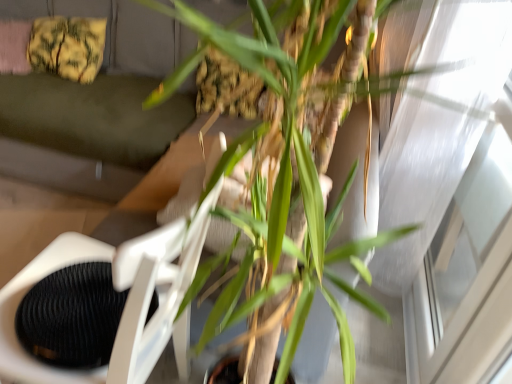
Question: From a real-world perspective, is transparent glass window at upper right on green leafy plant at center?

Choices:
 (A) yes
 (B) no

Answer: (B)

Question: From a real-world perspective, is transparent glass window at upper right below green leafy plant at center?

Choices:
 (A) yes
 (B) no

Answer: (A)

Question: Can you confirm if transparent glass window at upper right is smaller than green leafy plant at center?

Choices:
 (A) yes
 (B) no

Answer: (A)

Question: Considering the relative positions of transparent glass window at upper right and green leafy plant at center in the image provided, is transparent glass window at upper right behind green leafy plant at center?

Choices:
 (A) yes
 (B) no

Answer: (A)

Question: Is there a large distance between transparent glass window at upper right and green leafy plant at center?

Choices:
 (A) no
 (B) yes

Answer: (A)

Question: Does transparent glass window at upper right appear on the right side of green leafy plant at center?

Choices:
 (A) no
 (B) yes

Answer: (B)

Question: From a real-world perspective, is green fabric couch at upper center positioned under green leafy plant at center based on gravity?

Choices:
 (A) yes
 (B) no

Answer: (A)

Question: Is green fabric couch at upper center to the right of green leafy plant at center from the viewer's perspective?

Choices:
 (A) yes
 (B) no

Answer: (B)

Question: Can you confirm if green fabric couch at upper center is smaller than green leafy plant at center?

Choices:
 (A) yes
 (B) no

Answer: (B)

Question: From the image's perspective, is green fabric couch at upper center over green leafy plant at center?

Choices:
 (A) no
 (B) yes

Answer: (B)

Question: Does green fabric couch at upper center have a greater width compared to green leafy plant at center?

Choices:
 (A) yes
 (B) no

Answer: (A)

Question: Does green fabric couch at upper center lie in front of green leafy plant at center?

Choices:
 (A) no
 (B) yes

Answer: (A)

Question: Are green leafy plant at center and green fabric couch at upper center far apart?

Choices:
 (A) yes
 (B) no

Answer: (A)